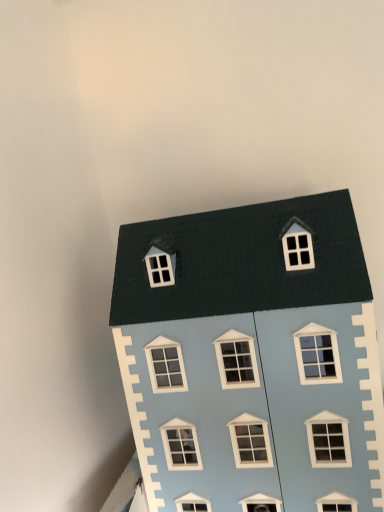
This screenshot has height=512, width=384. Find the location of `light blue matte house at center`. light blue matte house at center is located at coordinates (251, 358).

The width and height of the screenshot is (384, 512). What do you see at coordinates (251, 358) in the screenshot?
I see `light blue matte house at center` at bounding box center [251, 358].

Where is `light blue matte house at center`? This screenshot has height=512, width=384. light blue matte house at center is located at coordinates (251, 358).